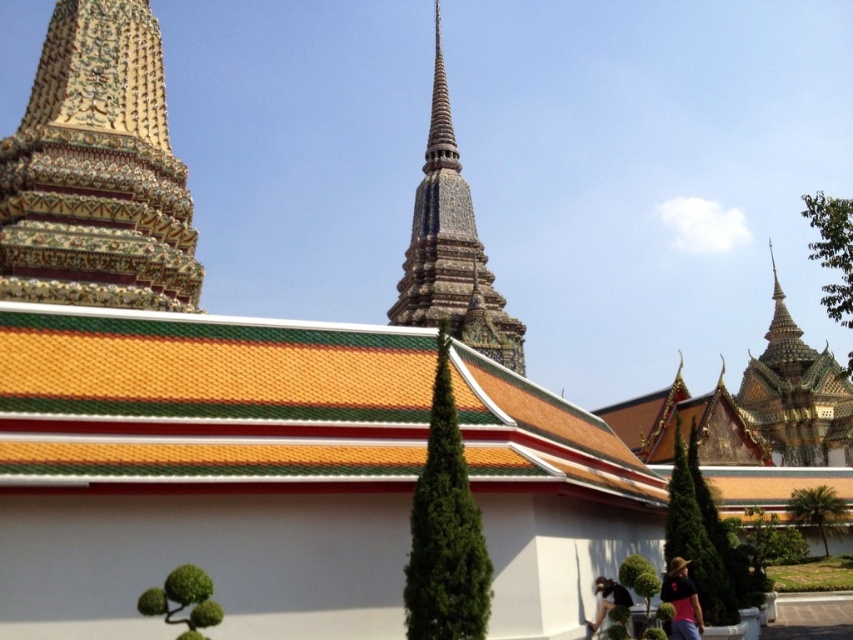
This screenshot has height=640, width=853. I want to click on pink fabric at lower right, so coord(682,602).

Which of these two, pink fabric at lower right or black fabric at lower right, stands shorter?

black fabric at lower right

At what (x,y) coordinates should I click in order to perform the action: click on pink fabric at lower right. Please return your answer as a coordinate pair (x, y). This screenshot has width=853, height=640. Looking at the image, I should click on (682, 602).

Does golden mosaic temple at upper left come behind black fabric at lower right?

Yes, golden mosaic temple at upper left is behind black fabric at lower right.

Is point (93, 260) behind point (602, 609)?

Yes, it is.

The width and height of the screenshot is (853, 640). I want to click on golden mosaic temple at upper left, so click(97, 172).

Between polished stone spire at center and pink fabric at lower right, which one is positioned higher?

polished stone spire at center is above.

Is polished stone spire at center positioned at the back of pink fabric at lower right?

Yes, polished stone spire at center is behind pink fabric at lower right.

Locate an element on the screen. The width and height of the screenshot is (853, 640). polished stone spire at center is located at coordinates (451, 248).

Identify the location of polished stone spire at center. (451, 248).